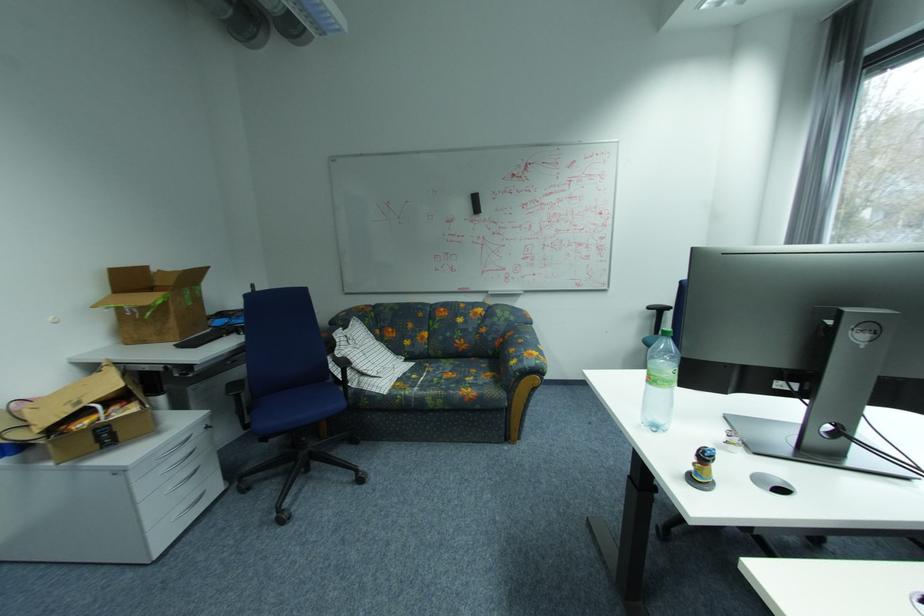
Where would you sit the blue chair surface? Please return your answer as a coordinate pair (x, y).

(299, 398)